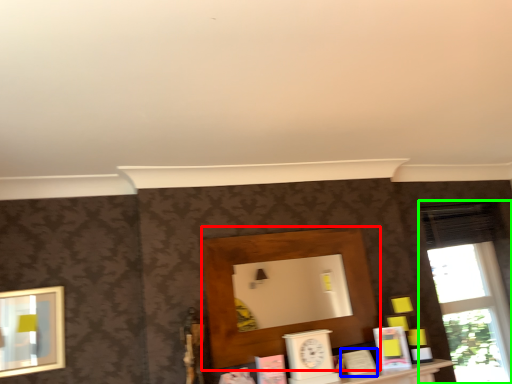
Question: Estimate the real-world distances between objects in this image. Which object is closer to shelf (highlighted by a red box), book (highlighted by a blue box) or window (highlighted by a green box)?

Choices:
 (A) book
 (B) window

Answer: (A)